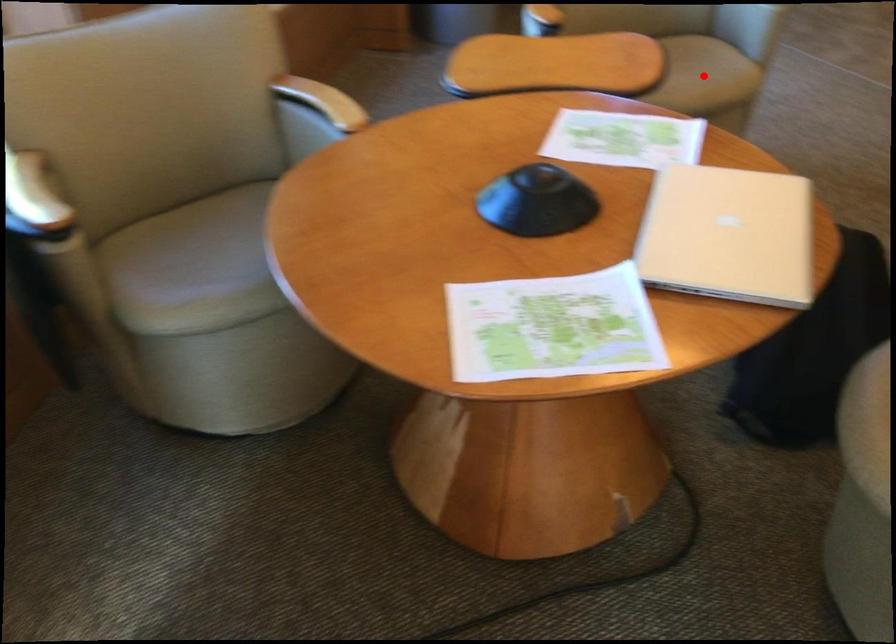
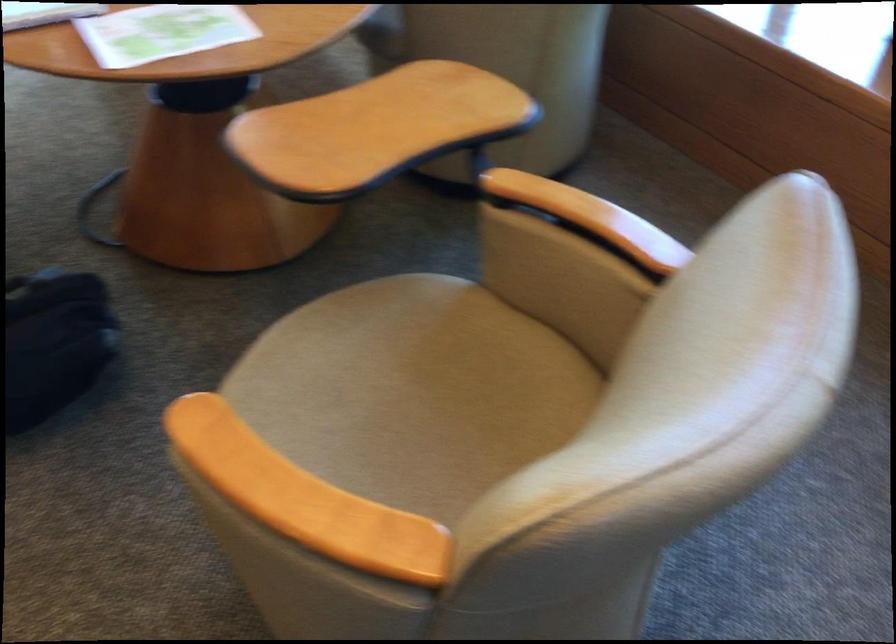
Question: I am providing you with two images of the same scene from different viewpoints. A red point is marked on the first image. Is the red point's position out of view in image 2?

Choices:
 (A) Yes
 (B) No

Answer: (A)